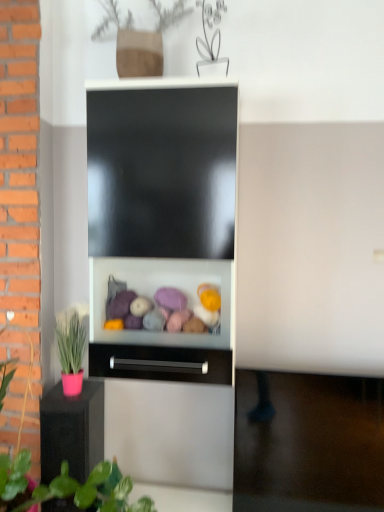
Question: From a real-world perspective, is pink matte pot at left above or below black matte drawer at center?

Choices:
 (A) below
 (B) above

Answer: (A)

Question: In the image, is pink matte pot at left positioned in front of or behind black matte drawer at center?

Choices:
 (A) behind
 (B) front

Answer: (B)

Question: Which object is positioned closest to the pink matte pot at left?

Choices:
 (A) pink matte pot at lower left
 (B) black matte drawer at center

Answer: (A)

Question: Estimate the real-world distances between objects in this image. Which object is closer to the pink matte pot at left?

Choices:
 (A) black matte drawer at center
 (B) pink matte pot at lower left

Answer: (B)